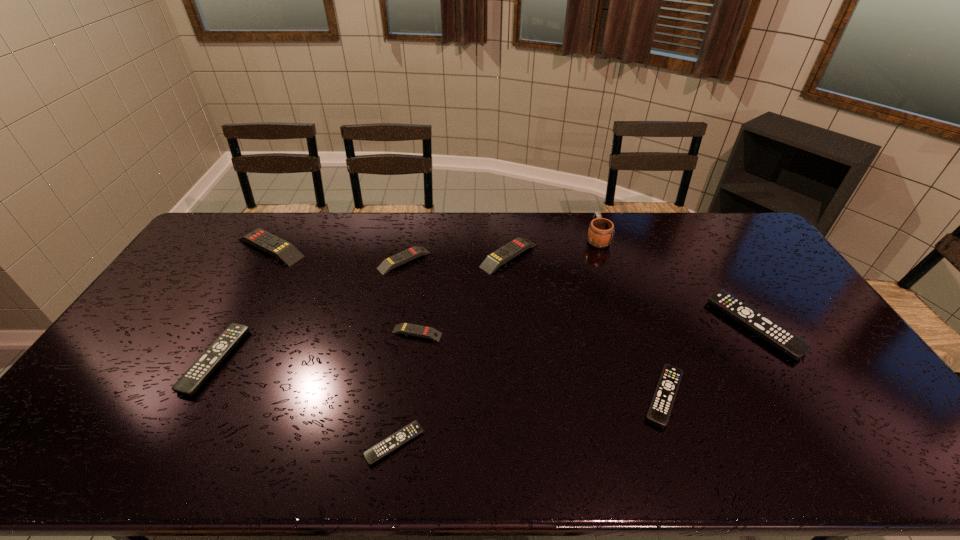
Where is `the seventh remote control from left to right`? The width and height of the screenshot is (960, 540). the seventh remote control from left to right is located at coordinates (660, 408).

At what (x,y) coordinates should I click in order to perform the action: click on the second smallest black remote control. Please return your answer as a coordinate pair (x, y). Image resolution: width=960 pixels, height=540 pixels. Looking at the image, I should click on (660, 408).

The height and width of the screenshot is (540, 960). I want to click on the shortest object, so click(388, 445).

Locate an element on the screen. the shortest remote control is located at coordinates (388, 445).

Locate an element on the screen. vacant region located on the side of the mug with the handle is located at coordinates (589, 215).

Where is `vacant space located on the side of the mug with the handle`? The image size is (960, 540). vacant space located on the side of the mug with the handle is located at coordinates (591, 220).

The width and height of the screenshot is (960, 540). In order to click on vacant space located 0.090m on the front of the biggest yellow remote control in this screenshot , I will do `click(250, 285)`.

Locate an element on the screen. The image size is (960, 540). vacant space located 0.360m on the front of the fourth object from right to left is located at coordinates click(x=517, y=361).

Find the location of a particular element. The width and height of the screenshot is (960, 540). vacant space located on the front of the rightmost remote control is located at coordinates (796, 394).

Locate an element on the screen. vacant space situated 0.160m on the left of the second smallest yellow remote control is located at coordinates (333, 261).